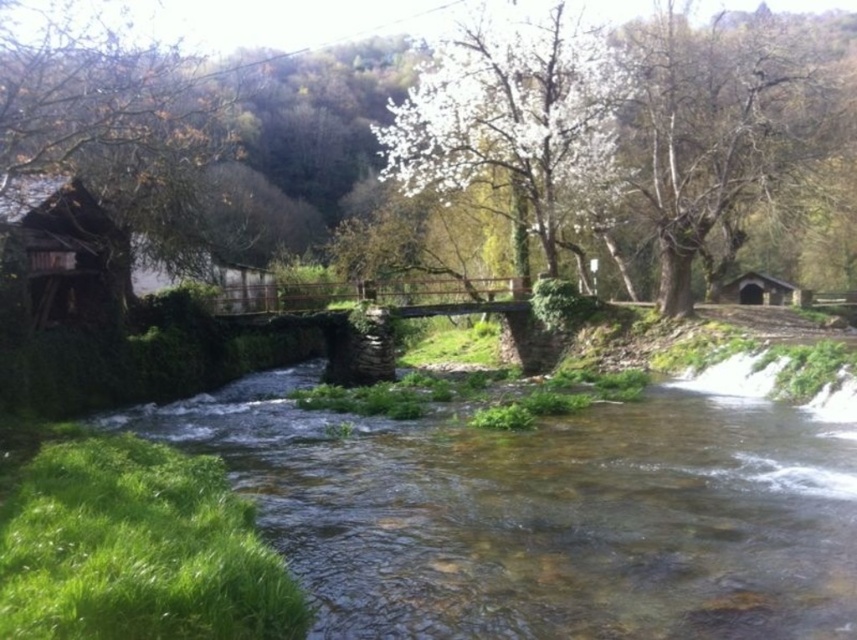
Is clear water at center wider than green leafy tree at center?

Correct, the width of clear water at center exceeds that of green leafy tree at center.

Which is behind, point (331, 588) or point (508, 152)?

Positioned behind is point (508, 152).

I want to click on clear water at center, so click(549, 509).

Who is positioned more to the right, brown rough tree at upper right or brown wood tree at center?

brown rough tree at upper right

Image resolution: width=857 pixels, height=640 pixels. Describe the element at coordinates (714, 124) in the screenshot. I see `brown rough tree at upper right` at that location.

This screenshot has width=857, height=640. Describe the element at coordinates (714, 124) in the screenshot. I see `brown rough tree at upper right` at that location.

This screenshot has width=857, height=640. I want to click on brown rough tree at upper right, so click(x=714, y=124).

Is point (640, 602) positioned in front of point (376, 10)?

Yes, it is.

Is clear water at center closer to the viewer compared to brown wood tree at center?

Yes, it is in front of brown wood tree at center.

Locate an element on the screen. Image resolution: width=857 pixels, height=640 pixels. clear water at center is located at coordinates (549, 509).

In order to click on clear water at center in this screenshot , I will do `click(549, 509)`.